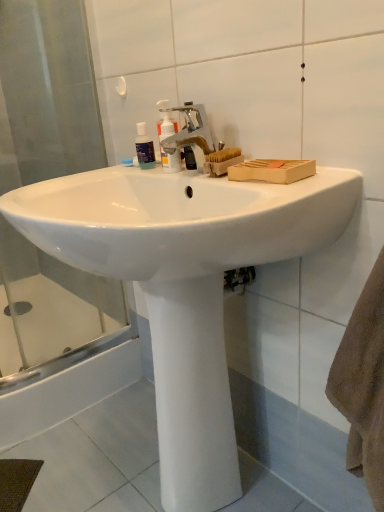
The image size is (384, 512). What are the coordinates of `vacant space to the left of transparent plastic bottle at upper center` in the screenshot? It's located at (86, 175).